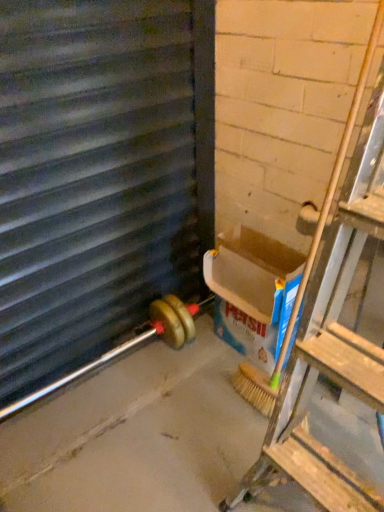
Describe the element at coordinates (253, 272) in the screenshot. I see `blue cardboard box at right` at that location.

Where is `blue cardboard box at right`? blue cardboard box at right is located at coordinates (253, 272).

In order to face blue cardboard box at right, should I rotate leftwards or rightwards?

A 8.212 degree turn to the right will do.

This screenshot has width=384, height=512. I want to click on metallic gray window frame at left, so click(x=97, y=174).

In order to face metallic gray window frame at left, should I rotate leftwards or rightwards?

Rotate your view left by about 13.043°.

Measure the distance between metallic gray window frame at left and camera.

metallic gray window frame at left is 36.64 inches from camera.

What do you see at coordinates (97, 174) in the screenshot? This screenshot has width=384, height=512. I see `metallic gray window frame at left` at bounding box center [97, 174].

Identify the location of blue cardboard box at right. The image size is (384, 512). (253, 272).

Considering the relative positions of blue cardboard box at right and metallic gray window frame at left in the image provided, is blue cardboard box at right to the left of metallic gray window frame at left from the viewer's perspective?

No, blue cardboard box at right is not to the left of metallic gray window frame at left.

Relative to metallic gray window frame at left, is blue cardboard box at right in front or behind?

Visually, blue cardboard box at right is located behind metallic gray window frame at left.

Considering the positions of point (279, 305) and point (21, 84), is point (279, 305) closer or farther from the camera than point (21, 84)?

Point (279, 305).

From the image's perspective, is blue cardboard box at right positioned above or below metallic gray window frame at left?

blue cardboard box at right is situated lower than metallic gray window frame at left in the image.

From the picture: From a real-world perspective, is blue cardboard box at right positioned under metallic gray window frame at left based on gravity?

Yes, from a real-world perspective, blue cardboard box at right is below metallic gray window frame at left.

Between blue cardboard box at right and metallic gray window frame at left, which one has smaller width?

With smaller width is metallic gray window frame at left.

Between blue cardboard box at right and metallic gray window frame at left, which one has more height?

metallic gray window frame at left is taller.

Considering the relative sizes of blue cardboard box at right and metallic gray window frame at left in the image provided, is blue cardboard box at right bigger than metallic gray window frame at left?

No, blue cardboard box at right is not bigger than metallic gray window frame at left.

Is blue cardboard box at right positioned beyond the bounds of metallic gray window frame at left?

Yes, blue cardboard box at right is located beyond the bounds of metallic gray window frame at left.

Can you see blue cardboard box at right touching metallic gray window frame at left?

blue cardboard box at right and metallic gray window frame at left are clearly separated.

Is metallic gray window frame at left at the back of blue cardboard box at right?

No, blue cardboard box at right is not facing away from metallic gray window frame at left.

Can you tell me how much blue cardboard box at right and metallic gray window frame at left differ in facing direction?

The angular difference between blue cardboard box at right and metallic gray window frame at left is 89 degrees.

Measure the distance between blue cardboard box at right and metallic gray window frame at left.

blue cardboard box at right is 46.54 centimeters from metallic gray window frame at left.

Image resolution: width=384 pixels, height=512 pixels. I want to click on window frame lying above the blue cardboard box at right (from the image's perspective), so click(x=97, y=174).

Between metallic gray window frame at left and blue cardboard box at right, which one appears on the left side from the viewer's perspective?

metallic gray window frame at left is more to the left.

Does metallic gray window frame at left lie behind blue cardboard box at right?

No, metallic gray window frame at left is closer to the camera.

Which is behind, point (178, 8) or point (208, 283)?

Positioned behind is point (208, 283).

From the image's perspective, is metallic gray window frame at left above blue cardboard box at right?

Yes, from the image's perspective, metallic gray window frame at left is over blue cardboard box at right.

Looking at this image, from a real-world perspective, which is physically above, metallic gray window frame at left or blue cardboard box at right?

metallic gray window frame at left.

Does metallic gray window frame at left have a lesser width compared to blue cardboard box at right?

Indeed, metallic gray window frame at left has a lesser width compared to blue cardboard box at right.

Can you confirm if metallic gray window frame at left is taller than blue cardboard box at right?

Correct, metallic gray window frame at left is much taller as blue cardboard box at right.

Considering the sizes of objects metallic gray window frame at left and blue cardboard box at right in the image provided, who is bigger, metallic gray window frame at left or blue cardboard box at right?

Bigger between the two is metallic gray window frame at left.

Would you say metallic gray window frame at left is outside blue cardboard box at right?

metallic gray window frame at left lies outside blue cardboard box at right's area.

Is metallic gray window frame at left far away from blue cardboard box at right?

No.

Could you tell me if metallic gray window frame at left is facing blue cardboard box at right?

Yes, metallic gray window frame at left is facing blue cardboard box at right.

How different are the orientations of metallic gray window frame at left and blue cardboard box at right in degrees?

They differ by 89 degrees in their facing directions.

The width and height of the screenshot is (384, 512). I want to click on box directly beneath the metallic gray window frame at left (from a real-world perspective), so click(x=253, y=272).

I want to click on box that is under the metallic gray window frame at left (from a real-world perspective), so click(x=253, y=272).

Locate an element on the screen. The width and height of the screenshot is (384, 512). window frame on the left of blue cardboard box at right is located at coordinates (97, 174).